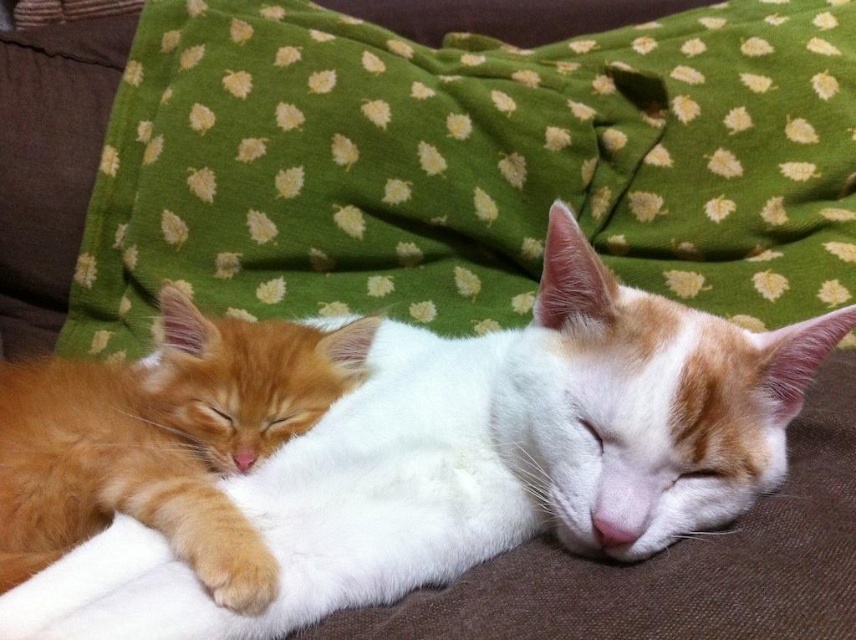
You are a cat owner who wants to place a small heating pad between the white soft fur cat at center and the fluffy orange cat at center while they sleep. Based on their sizes, which cat might require the heating pad to be placed closer to them?

The white soft fur cat at center is much taller than the fluffy orange cat at center, so the heating pad should be placed closer to the fluffy orange cat at center to accommodate the height difference between them.

You are a photographer trying to capture a clear photo of the fluffy orange cat at center. However, the white soft fur cat at center is blocking your view. Can you adjust your position to take the photo without moving either cat?

The white soft fur cat at center is in front of the fluffy orange cat at center, so you can move your camera position slightly to the side to avoid the obstruction caused by the white soft fur cat at center and capture the fluffy orange cat at center.